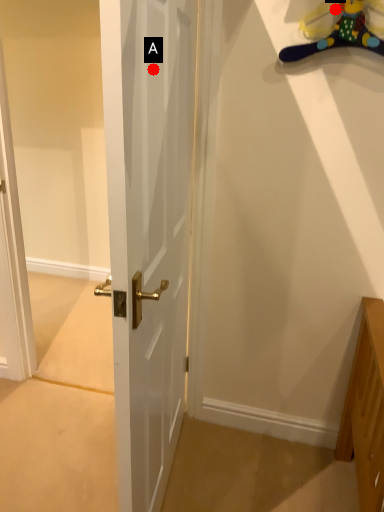
Question: Two points are circled on the image, labeled by A and B beside each circle. Among these points, which one is farthest from the camera?

Choices:
 (A) A is further
 (B) B is further

Answer: (B)